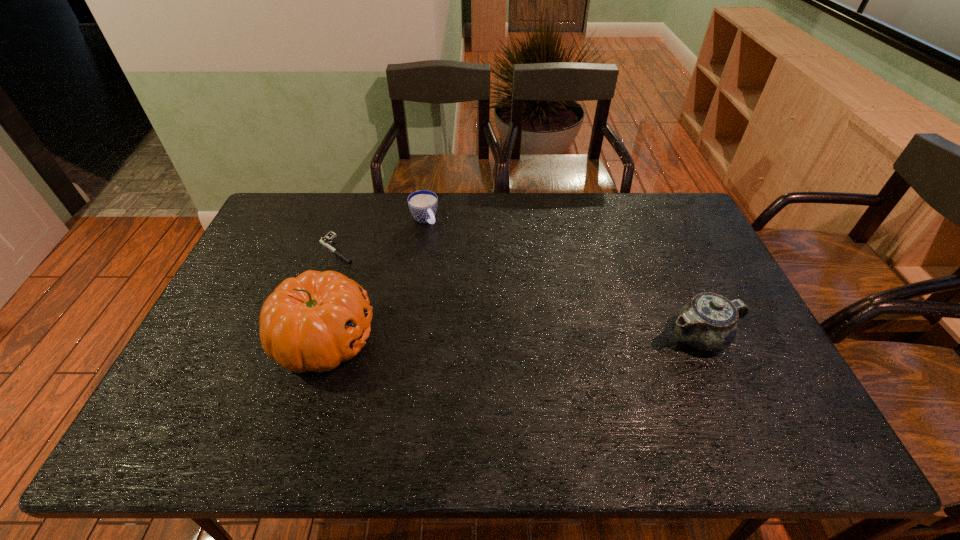
The image size is (960, 540). In the image, there is a desktop. Identify the location of free space at the right edge. (722, 288).

The width and height of the screenshot is (960, 540). I want to click on vacant space at the near left corner of the desktop, so click(x=214, y=407).

Find the location of a particular element. This screenshot has height=540, width=960. vacant area at the far right corner is located at coordinates (662, 228).

Locate an element on the screen. The image size is (960, 540). free space between the pistol and the chinaware is located at coordinates (519, 293).

Identify the location of unoccupied area between the shortest object and the chinaware. Image resolution: width=960 pixels, height=540 pixels. (519, 293).

Find the location of `vacant space that's between the chinaware and the pistol`. vacant space that's between the chinaware and the pistol is located at coordinates (519, 293).

Locate an element on the screen. free spot between the cup and the chinaware is located at coordinates (563, 278).

In order to click on vacant space that is in between the third tallest object and the shortest object in this screenshot , I will do `click(380, 234)`.

Locate an element on the screen. vacant area between the second object from right to left and the tallest object is located at coordinates (374, 279).

In order to click on vacant space in between the third shortest object and the pumpkin in this screenshot , I will do `click(513, 338)`.